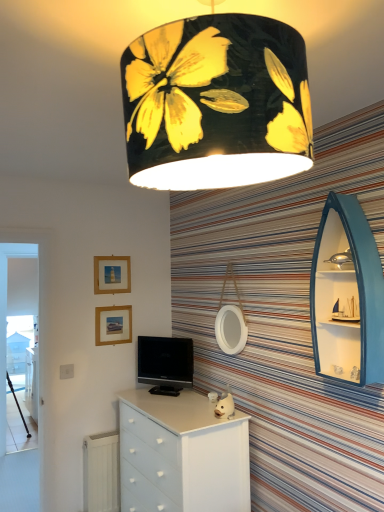
Identify the location of free spot to the left of transparent glass screen door at left. The width and height of the screenshot is (384, 512). (16, 443).